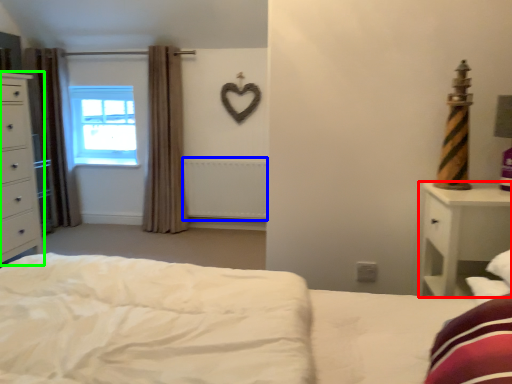
Question: Estimate the real-world distances between objects in this image. Which object is closer to nightstand (highlighted by a red box), radiator (highlighted by a blue box) or chest of drawers (highlighted by a green box)?

Choices:
 (A) radiator
 (B) chest of drawers

Answer: (A)